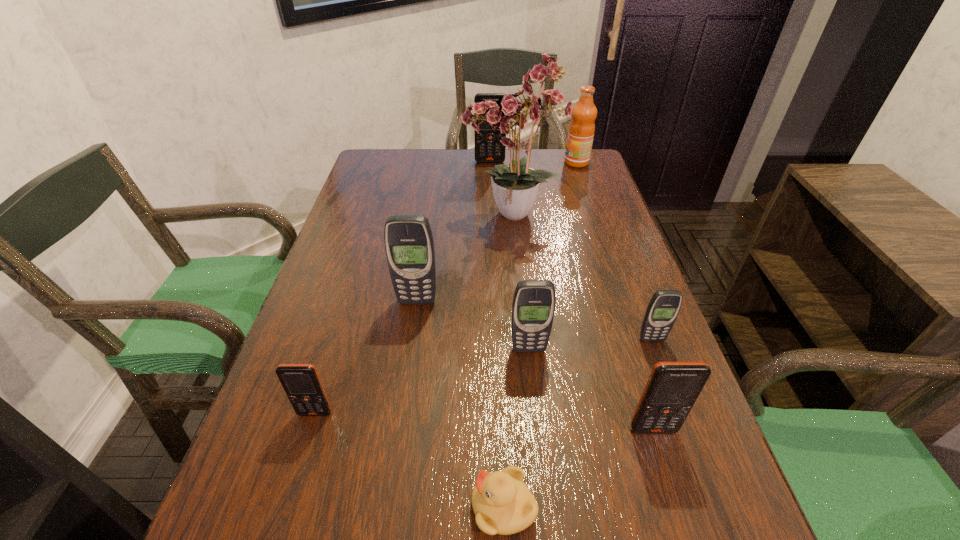
This screenshot has height=540, width=960. What are the coordinates of `the tallest object` in the screenshot? It's located at (515, 187).

Where is `the seventh nearest object`? The width and height of the screenshot is (960, 540). the seventh nearest object is located at coordinates (515, 187).

Locate an element on the screen. fruit juice is located at coordinates (580, 136).

You are a GUI agent. You are given a task and a screenshot of the screen. Output one action in this format:
    pyautogui.click(x=<x>, y=<y>)
    Task: Click on the farthest orange cellular telephone
    
    Given the screenshot: What is the action you would take?
    pyautogui.click(x=485, y=147)

The image size is (960, 540). Identify the location of the biggest orange cellular telephone. (485, 147).

Where is `the second cellular telephone from left to right`? the second cellular telephone from left to right is located at coordinates (409, 245).

Where is `the leftmost gray cellular telephone`? The height and width of the screenshot is (540, 960). the leftmost gray cellular telephone is located at coordinates (409, 245).

Locate an element on the screen. This screenshot has height=540, width=960. the second smallest gray cellular telephone is located at coordinates (533, 308).

Find the location of a particular element. The image size is (960, 540). the fourth nearest object is located at coordinates (533, 308).

At what (x,y) coordinates should I click in order to perform the action: click on the nearest cellular telephone. Please return your answer as a coordinate pair (x, y). The height and width of the screenshot is (540, 960). Looking at the image, I should click on (672, 389).